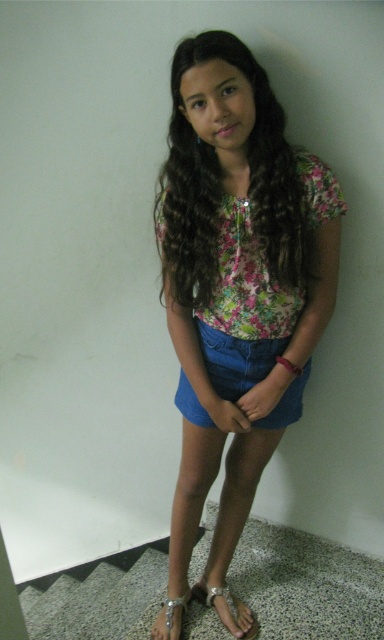
You are an interior designer planning to place a new painting on the wall. The painting must be positioned so that it does not overlap with the floral fabric blouse at center. Where should you place the painting to ensure it stays above the blouse?

The floral fabric blouse at center is located at point (236,282). To place the painting above it without overlapping, position the painting higher on the wall, ensuring its lower edge is above the blouse.

You are a photographer standing at a certain distance from the girl in the image. You want to take a closeup shot of her face without making her uncomfortable. Considering the distance between you and the floral fabric blouse at center, what is the minimum distance you should maintain?

The floral fabric blouse at center is 1.27 meters away from the viewer. To take a closeup shot of her face without discomfort, maintain at least 1.27 meters distance, as that is the current proximity to the blouse, which is near her torso. Moving closer might invade her personal space.